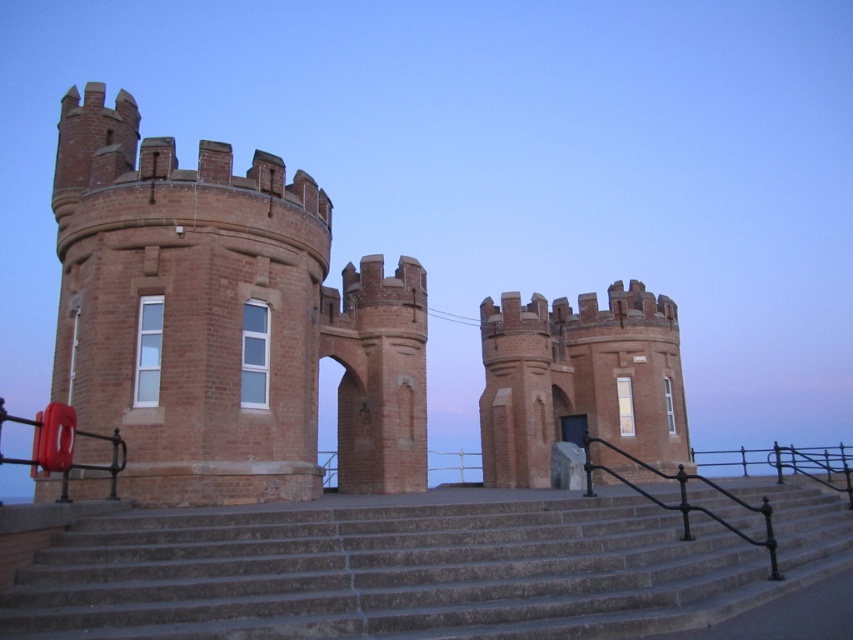
Question: Is the position of brick tower at center more distant than that of gray concrete stairs at center?

Choices:
 (A) no
 (B) yes

Answer: (B)

Question: Which point is farther from the camera taking this photo?

Choices:
 (A) (720, 552)
 (B) (148, 202)

Answer: (B)

Question: Is brick tower at center to the right of gray concrete stairs at center from the viewer's perspective?

Choices:
 (A) no
 (B) yes

Answer: (A)

Question: Does brick tower at center have a larger size compared to gray concrete stairs at center?

Choices:
 (A) yes
 (B) no

Answer: (A)

Question: Among these objects, which one is nearest to the camera?

Choices:
 (A) gray concrete stairs at center
 (B) brick tower at center

Answer: (A)